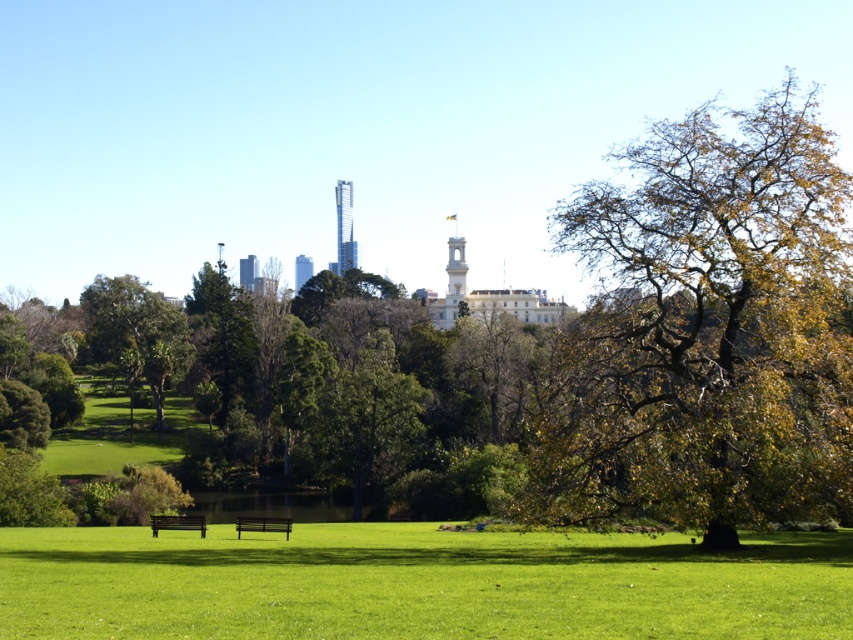
Question: Which of the following is the farthest from the observer?

Choices:
 (A) wooden bench at center
 (B) golden-brown textured tree at right
 (C) smooth glass skyscraper at center
 (D) green grassy field at lower center

Answer: (C)

Question: Is green grassy field at lower center bigger than green wooden bench at lower left?

Choices:
 (A) no
 (B) yes

Answer: (B)

Question: Which point is farther to the camera?

Choices:
 (A) (573, 486)
 (B) (341, 216)

Answer: (B)

Question: Among these points, which one is nearest to the camera?

Choices:
 (A) (341, 208)
 (B) (300, 262)
 (C) (654, 380)

Answer: (C)

Question: Does golden-brown textured tree at right have a smaller size compared to smooth glass skyscraper at center?

Choices:
 (A) no
 (B) yes

Answer: (A)

Question: Considering the relative positions of golden-brown textured tree at right and green wooden bench at lower left in the image provided, where is golden-brown textured tree at right located with respect to green wooden bench at lower left?

Choices:
 (A) above
 (B) below

Answer: (A)